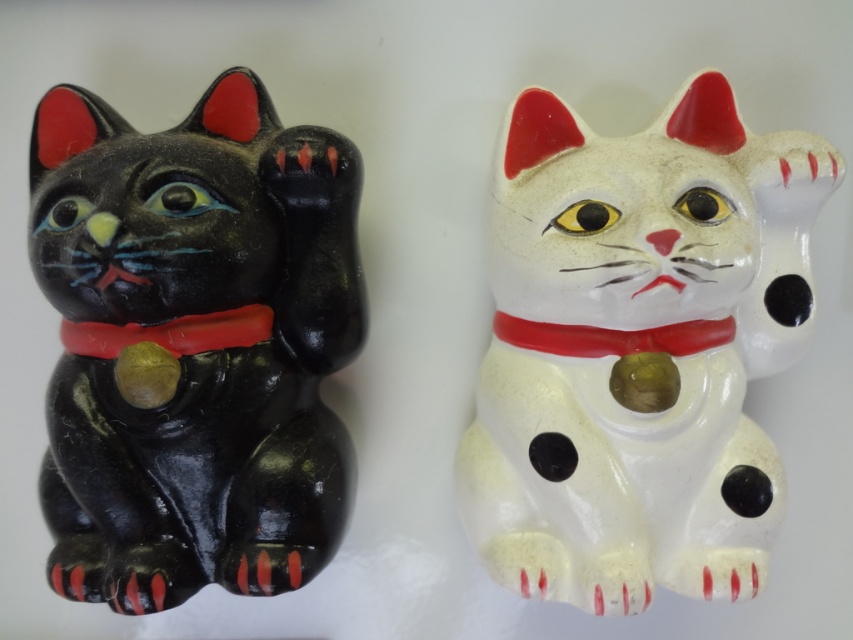
You are an art curator arranging an exhibition. You have two cats to display side by side on a shelf. The white glossy cat at upper center and the shiny black cat at left. Which cat should you place on the higher shelf to maintain visual balance?

The white glossy cat at upper center is taller than the shiny black cat at left, so placing it on a higher shelf would maintain visual balance by aligning their heights appropriately.

In the scene shown: You are an art curator arranging an exhibition. You need to ensure that the white glossy cat at upper center is visible from below the shiny black cat at left. Is the current arrangement suitable for this requirement?

Yes, the current arrangement is suitable because the white glossy cat at upper center is positioned under the shiny black cat at left, allowing it to be visible from below.